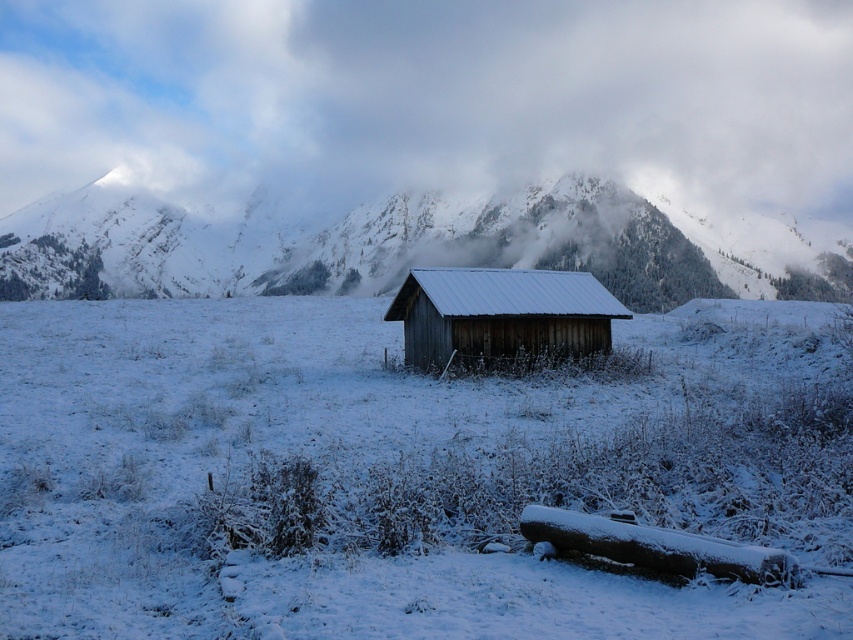
Who is more distant from viewer, (635,204) or (426,316)?

Point (635,204)

Which is more to the right, snowy wooden mountain at center or wooden cabin at center?

From the viewer's perspective, wooden cabin at center appears more on the right side.

Consider the image. Who is more distant from viewer, (310, 244) or (486, 285)?

Point (310, 244)

Identify the location of snowy wooden mountain at center. This screenshot has width=853, height=640. (404, 246).

Who is shorter, white fluffy cloud at upper center or wooden cabin at center?

wooden cabin at center is shorter.

Who is positioned more to the left, white fluffy cloud at upper center or wooden cabin at center?

white fluffy cloud at upper center

Who is more distant from viewer, [123,65] or [531,285]?

Point [123,65]

This screenshot has height=640, width=853. I want to click on white fluffy cloud at upper center, so click(x=430, y=99).

Can you confirm if white fluffy cloud at upper center is thinner than snowy wooden mountain at center?

In fact, white fluffy cloud at upper center might be wider than snowy wooden mountain at center.

Who is positioned more to the left, white fluffy cloud at upper center or snowy wooden mountain at center?

white fluffy cloud at upper center

What are the coordinates of `white fluffy cloud at upper center` in the screenshot? It's located at (430, 99).